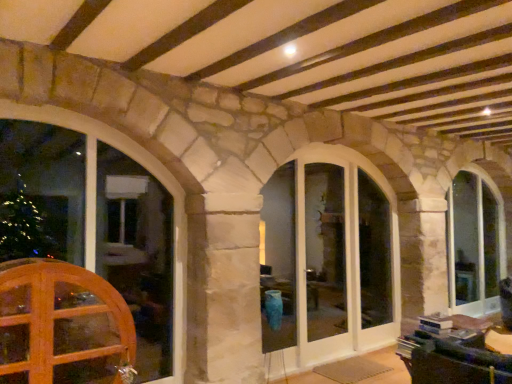
Question: Is white glass door at center taller than wooden glass door at lower left?

Choices:
 (A) yes
 (B) no

Answer: (A)

Question: Does white glass door at center have a smaller size compared to wooden glass door at lower left?

Choices:
 (A) yes
 (B) no

Answer: (A)

Question: Is white glass door at center shorter than wooden glass door at lower left?

Choices:
 (A) yes
 (B) no

Answer: (B)

Question: From the image's perspective, is white glass door at center below wooden glass door at lower left?

Choices:
 (A) no
 (B) yes

Answer: (A)

Question: Are white glass door at center and wooden glass door at lower left making contact?

Choices:
 (A) yes
 (B) no

Answer: (B)

Question: Which is correct: white glass door at center is inside wooden glass door at lower left, or outside of it?

Choices:
 (A) outside
 (B) inside

Answer: (A)

Question: Is white glass door at center bigger or smaller than wooden glass door at lower left?

Choices:
 (A) big
 (B) small

Answer: (B)

Question: Considering their positions, is white glass door at center located in front of or behind wooden glass door at lower left?

Choices:
 (A) behind
 (B) front

Answer: (A)

Question: Is white glass door at center wider or thinner than wooden glass door at lower left?

Choices:
 (A) wide
 (B) thin

Answer: (B)

Question: Is white glass door at center in front of or behind wooden window at left, which appears as the first window when viewed from the left, in the image?

Choices:
 (A) behind
 (B) front

Answer: (A)

Question: Is point [x=330, y=185] closer or farther from the camera than point [x=174, y=240]?

Choices:
 (A) farther
 (B) closer

Answer: (A)

Question: Looking at the image, does white glass door at center seem bigger or smaller compared to wooden window at left, the 1th window from the front?

Choices:
 (A) small
 (B) big

Answer: (A)

Question: From a real-world perspective, relative to wooden window at left, which appears as the first window when viewed from the left, is white glass door at center vertically above or below?

Choices:
 (A) below
 (B) above

Answer: (B)

Question: Considering their positions, is wooden window at left, the 1th window from the front, located in front of or behind white glass door at center?

Choices:
 (A) front
 (B) behind

Answer: (A)

Question: From the image's perspective, is wooden window at left, the 1th window from the front, located above or below white glass door at center?

Choices:
 (A) above
 (B) below

Answer: (A)